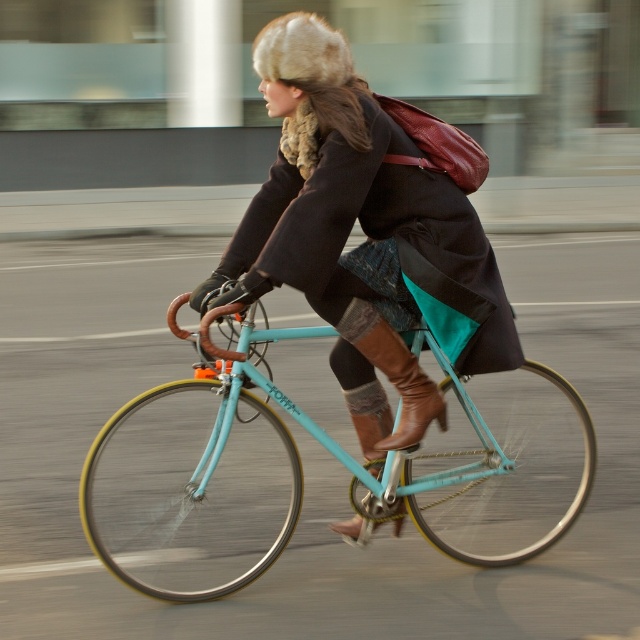
Is brown leather boot at center further to the viewer compared to brown suede boot at center?

No, it is not.

Which is in front, point (387, 362) or point (388, 419)?

Positioned in front is point (387, 362).

Is point (400, 376) less distant than point (362, 451)?

Yes, it is.

Where is `brown leather boot at center`? brown leather boot at center is located at coordinates (394, 372).

Can you confirm if teal matte bicycle at center is smaller than matte black coat at center?

Incorrect, teal matte bicycle at center is not smaller in size than matte black coat at center.

From the picture: Is teal matte bicycle at center to the right of matte black coat at center from the viewer's perspective?

Yes, teal matte bicycle at center is to the right of matte black coat at center.

Locate an element on the screen. This screenshot has width=640, height=640. teal matte bicycle at center is located at coordinates (336, 458).

Locate an element on the screen. teal matte bicycle at center is located at coordinates (336, 458).

Based on the photo, is matte black coat at center above brown leather boot at center?

Indeed, matte black coat at center is positioned over brown leather boot at center.

Who is more distant from viewer, [426,180] or [369,320]?

The point [426,180] is more distant.

In order to click on matte black coat at center in this screenshot , I will do `click(365, 234)`.

You are a GUI agent. You are given a task and a screenshot of the screen. Output one action in this format:
    pyautogui.click(x=<x>, y=<y>)
    Task: Click on the matte black coat at center
    The image size is (640, 640).
    Given the screenshot: What is the action you would take?
    pyautogui.click(x=365, y=234)